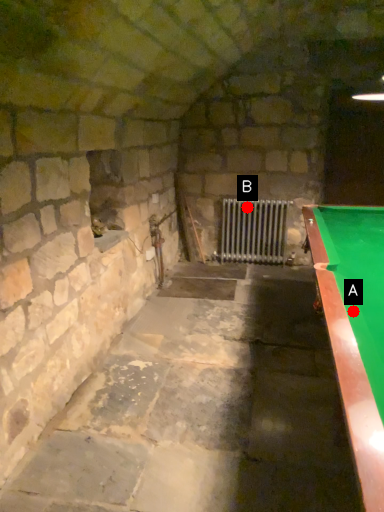
Question: Two points are circled on the image, labeled by A and B beside each circle. Among these points, which one is farthest from the camera?

Choices:
 (A) A is further
 (B) B is further

Answer: (B)